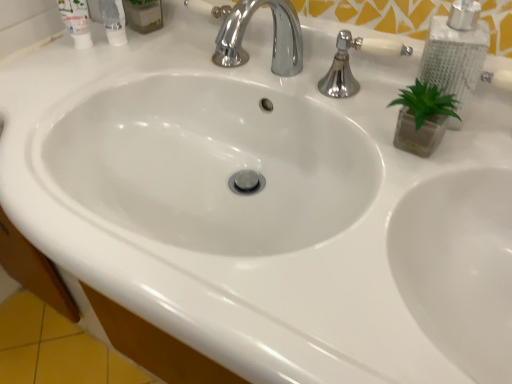
Locate an element on the screen. Image resolution: width=512 pixels, height=384 pixels. unoccupied region to the right of white plastic mouthwash at upper left, the first mouthwash viewed from the right is located at coordinates [194, 61].